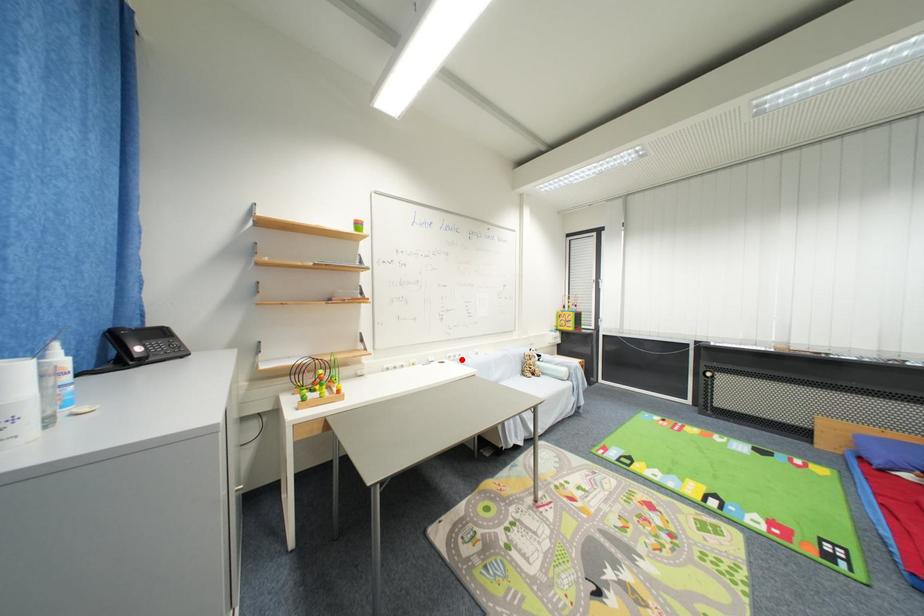
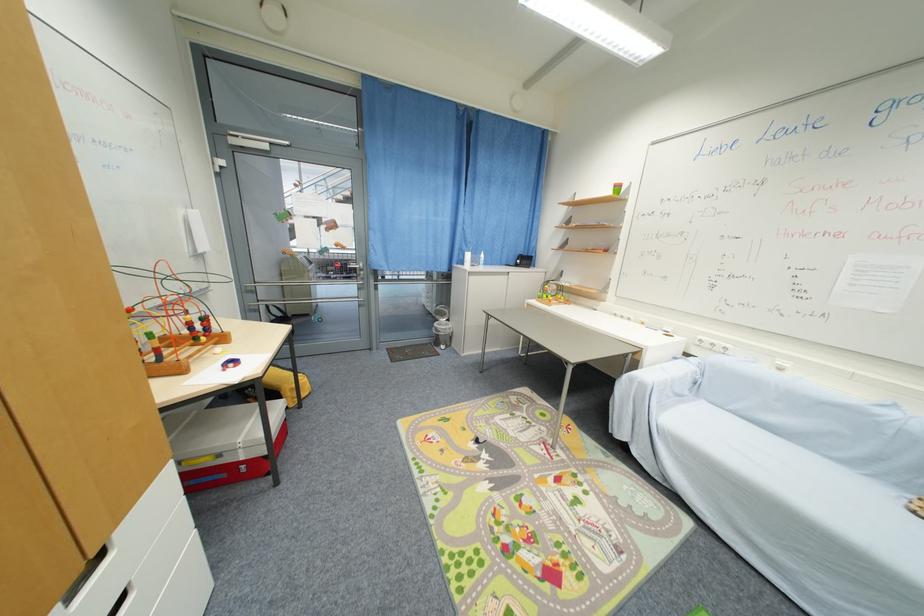
Where in the second image is the point corresponding to the highlighted location from the first image?

(723, 351)